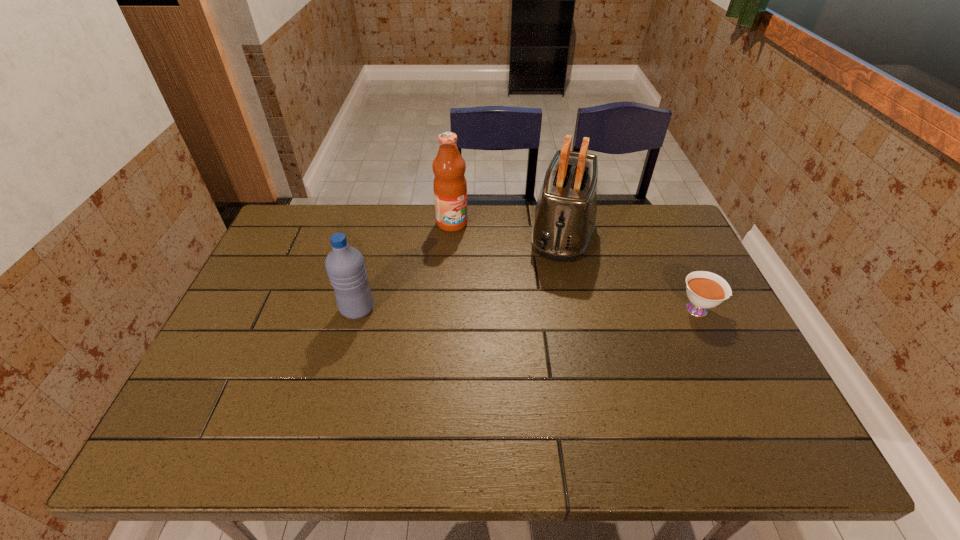
Find the location of a particular element. the leftmost object is located at coordinates (345, 266).

At what (x,y) coordinates should I click in order to perform the action: click on water bottle. Please return your answer as a coordinate pair (x, y). Image resolution: width=960 pixels, height=540 pixels. Looking at the image, I should click on (345, 266).

I want to click on teacup, so click(x=704, y=290).

Locate an element on the screen. the shortest object is located at coordinates 704,290.

Find the location of a particular element. This screenshot has height=540, width=960. fruit juice is located at coordinates (450, 187).

This screenshot has width=960, height=540. I want to click on the third object from left to right, so click(x=564, y=220).

Identify the location of blank space located on the right of the second shortest object. (441, 309).

At what (x,y) coordinates should I click in order to perform the action: click on free spot located 0.220m on the front label of the fruit juice. Please return your answer as a coordinate pair (x, y). This screenshot has height=540, width=960. Looking at the image, I should click on (501, 267).

Locate an element on the screen. vacant space situated on the front label of the fruit juice is located at coordinates (527, 291).

Locate an element on the screen. vacant space located 0.300m on the front label of the fruit juice is located at coordinates (518, 282).